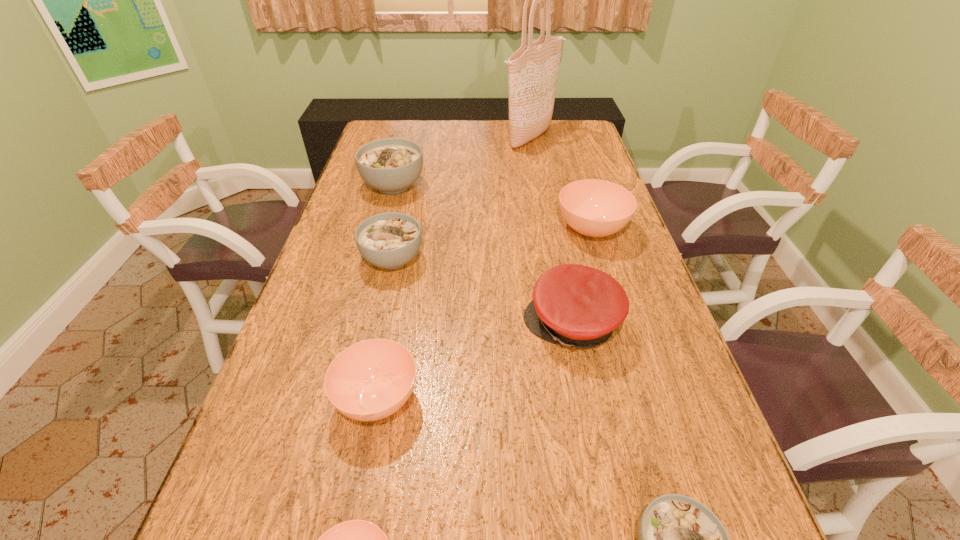
Image resolution: width=960 pixels, height=540 pixels. Find the location of `vacant area in the image that satisfies the following two spatial constraints: 1. on the back side of the second nearest peach soup bowl; 2. on the left side of the rightmost peach soup bowl`. vacant area in the image that satisfies the following two spatial constraints: 1. on the back side of the second nearest peach soup bowl; 2. on the left side of the rightmost peach soup bowl is located at coordinates pyautogui.click(x=410, y=229).

You are a GUI agent. You are given a task and a screenshot of the screen. Output one action in this format:
    pyautogui.click(x=<x>, y=<y>)
    Task: Click on the free space in the image that satisfies the following two spatial constraints: 1. on the front side of the farthest peach soup bowl; 2. on the right side of the shopping bag
    This screenshot has width=960, height=540.
    Given the screenshot: What is the action you would take?
    pyautogui.click(x=547, y=229)

Image resolution: width=960 pixels, height=540 pixels. I want to click on vacant space that satisfies the following two spatial constraints: 1. on the front side of the rightmost peach soup bowl; 2. on the front of the red cap with an emblem, so (621, 324).

The image size is (960, 540). I want to click on free space that satisfies the following two spatial constraints: 1. on the back side of the shopping bag; 2. on the right side of the second nearest white soup bowl, so click(420, 138).

Locate an element on the screen. This screenshot has height=540, width=960. vacant space that satisfies the following two spatial constraints: 1. on the front side of the rightmost peach soup bowl; 2. on the front of the cap with an emblem is located at coordinates (621, 324).